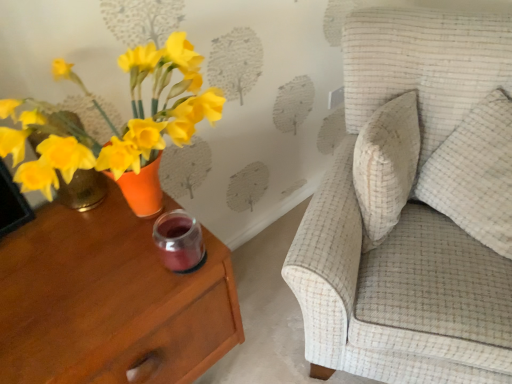
What is the approximate width of matte wood nightstand at left?

The width of matte wood nightstand at left is 19.29 inches.

At what (x,y) coordinates should I click in order to perform the action: click on textured beige sofa at upper right. Please return your answer as a coordinate pair (x, y). The width and height of the screenshot is (512, 384). Looking at the image, I should click on (415, 206).

Locate an element on the screen. white textured pillow at right is located at coordinates [x=475, y=174].

In order to face white textured pillow at right, should I rotate leftwards or rightwards?

It's best to rotate right around 30.076 degrees.

You are a GUI agent. You are given a task and a screenshot of the screen. Output one action in this format:
    pyautogui.click(x=<x>, y=<y>)
    Task: Click on the matte wood nightstand at left
    
    Given the screenshot: What is the action you would take?
    pyautogui.click(x=108, y=300)

Would you say textured beige sofa at upper right is outside matte wood nightstand at left?

Indeed, textured beige sofa at upper right is completely outside matte wood nightstand at left.

Does point (454, 341) come behind point (66, 264)?

Yes, point (454, 341) is farther from viewer.

Is textured beige sofa at upper right positioned with its back to matte wood nightstand at left?

No, textured beige sofa at upper right is not facing the opposite direction of matte wood nightstand at left.

Looking at this image, is textured beige sofa at upper right far from matte wood nightstand at left?

No, there isn't a large distance between textured beige sofa at upper right and matte wood nightstand at left.

Are white textured pillow at right and matte wood nightstand at left far apart?

No, white textured pillow at right is not far away from matte wood nightstand at left.

Is white textured pillow at right surrounding matte wood nightstand at left?

Actually, matte wood nightstand at left is outside white textured pillow at right.

Is point (431, 155) positioned after point (193, 291)?

Yes, point (431, 155) is behind point (193, 291).

Measure the distance between matte wood nightstand at left and textured beige sofa at upper right.

19.43 inches.

Between matte wood nightstand at left and textured beige sofa at upper right, which one is positioned behind?

matte wood nightstand at left is further from the camera.

Is textured beige sofa at upper right surrounded by matte wood nightstand at left?

→ Definitely not — textured beige sofa at upper right is not inside matte wood nightstand at left.

Is textured beige sofa at upper right at the back of matte wood nightstand at left?

No, matte wood nightstand at left's orientation is not away from textured beige sofa at upper right.

Does textured beige sofa at upper right have a greater width compared to white textured pillow at right?

Correct, the width of textured beige sofa at upper right exceeds that of white textured pillow at right.

Is textured beige sofa at upper right in front of or behind white textured pillow at right in the image?

Visually, textured beige sofa at upper right is located in front of white textured pillow at right.

Considering the positions of point (475, 269) and point (473, 194), is point (475, 269) closer or farther from the camera than point (473, 194)?

Point (475, 269) is closer to the camera than point (473, 194).

In the scene shown: Between textured beige sofa at upper right and white textured pillow at right, which one has less height?

Standing shorter between the two is white textured pillow at right.

Is matte wood nightstand at left positioned beyond the bounds of white textured pillow at right?

Yes, matte wood nightstand at left is not within white textured pillow at right.

Is matte wood nightstand at left taller or shorter than white textured pillow at right?

In the image, matte wood nightstand at left appears to be taller than white textured pillow at right.

Is matte wood nightstand at left further to the viewer compared to white textured pillow at right?

No, it is not.

From the image's perspective, which object appears higher, matte wood nightstand at left or white textured pillow at right?

white textured pillow at right is shown above in the image.

Looking at this image, from the image's perspective, is white textured pillow at right located above textured beige sofa at upper right?

Correct, white textured pillow at right appears higher than textured beige sofa at upper right in the image.

Locate an element on the screen. Image resolution: width=512 pixels, height=384 pixels. chair below the white textured pillow at right (from the image's perspective) is located at coordinates (415, 206).

Find the location of a particular element. The width and height of the screenshot is (512, 384). nightstand on the left side of textured beige sofa at upper right is located at coordinates (108, 300).

Identify the location of pillow above the matte wood nightstand at left (from a real-world perspective). The width and height of the screenshot is (512, 384). (475, 174).

Estimate the real-world distances between objects in this image. Which object is further from white textured pillow at right, matte wood nightstand at left or textured beige sofa at upper right?

Based on the image, matte wood nightstand at left appears to be further to white textured pillow at right.

Based on their spatial positions, is matte wood nightstand at left or white textured pillow at right further from textured beige sofa at upper right?

The object further to textured beige sofa at upper right is matte wood nightstand at left.

Considering their positions, is white textured pillow at right positioned further to textured beige sofa at upper right than matte wood nightstand at left?

matte wood nightstand at left is further to textured beige sofa at upper right.

Considering their positions, is textured beige sofa at upper right positioned closer to white textured pillow at right than matte wood nightstand at left?

textured beige sofa at upper right is closer to white textured pillow at right.

Based on their spatial positions, is textured beige sofa at upper right or white textured pillow at right closer to matte wood nightstand at left?

textured beige sofa at upper right is closer to matte wood nightstand at left.

From the image, which object appears to be farther from matte wood nightstand at left, white textured pillow at right or textured beige sofa at upper right?

The object further to matte wood nightstand at left is white textured pillow at right.

The image size is (512, 384). Find the location of `chair located between matte wood nightstand at left and white textured pillow at right in the left-right direction`. chair located between matte wood nightstand at left and white textured pillow at right in the left-right direction is located at coordinates (415, 206).